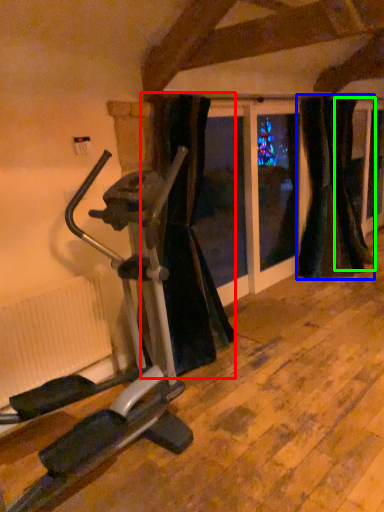
Question: Based on their relative distances, which object is farther from curtain (highlighted by a red box)? Choose from curtain (highlighted by a blue box) and curtain (highlighted by a green box).

Choices:
 (A) curtain
 (B) curtain

Answer: (B)